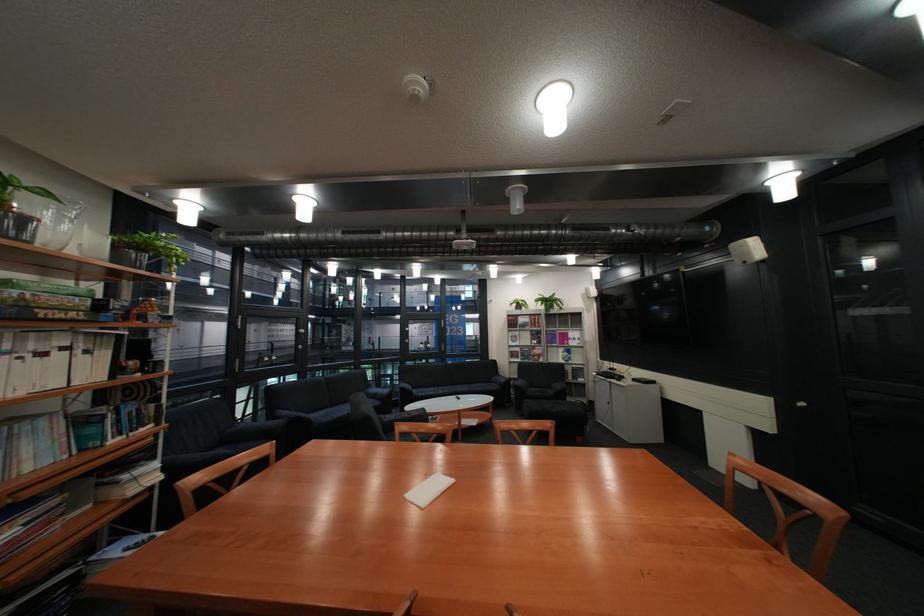
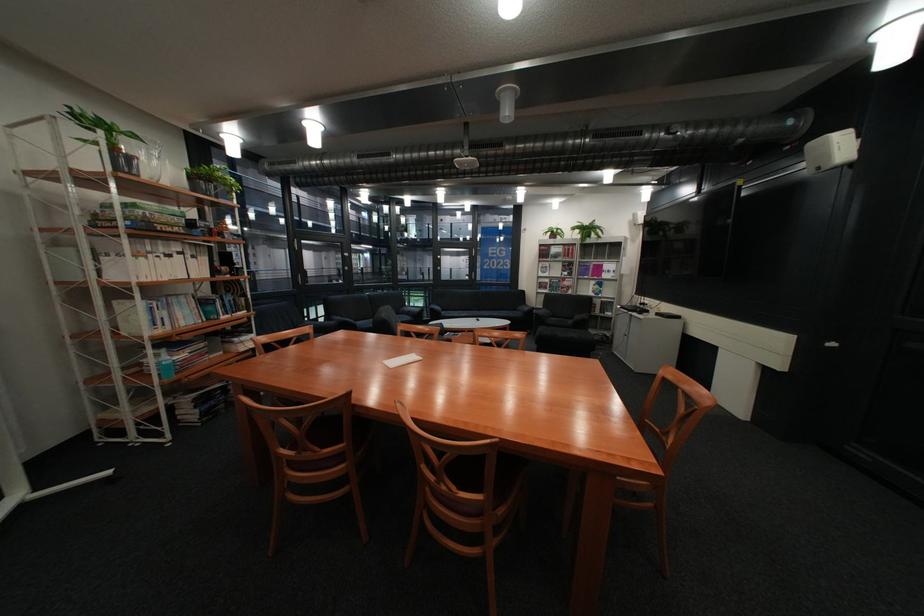
In the second image, find the point that corresponds to point 527,304 in the first image.

(562, 233)